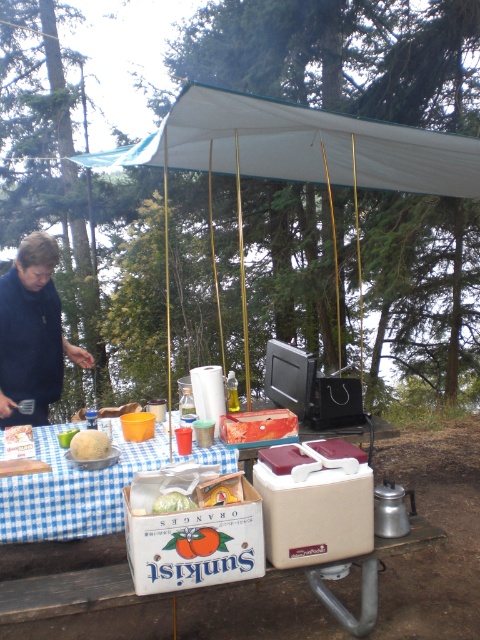
Can you confirm if blue checkered tablecloth at lower left is smaller than white fluffy bread at center?

No, blue checkered tablecloth at lower left is not smaller than white fluffy bread at center.

Between point (39, 538) and point (93, 432), which one is positioned behind?

The point (93, 432) is more distant.

The height and width of the screenshot is (640, 480). Identify the location of blue checkered tablecloth at lower left. (73, 488).

Is white fabric canopy at upper center shorter than translucent plastic bag at center?

In fact, white fabric canopy at upper center may be taller than translucent plastic bag at center.

Can you confirm if white fabric canopy at upper center is positioned to the right of translucent plastic bag at center?

Yes, white fabric canopy at upper center is to the right of translucent plastic bag at center.

Does point (313, 168) lie in front of point (167, 497)?

No, (313, 168) is further to viewer.

What are the coordinates of `white fabric canopy at upper center` in the screenshot? It's located at (299, 145).

Does white fabric canopy at upper center come in front of dark blue fabric at left?

That is True.

Between white fabric canopy at upper center and dark blue fabric at left, which one has more height?

With more height is dark blue fabric at left.

At what (x,y) coordinates should I click in order to perform the action: click on white fabric canopy at upper center. Please return your answer as a coordinate pair (x, y). Looking at the image, I should click on (299, 145).

This screenshot has height=640, width=480. In order to click on white fabric canopy at upper center in this screenshot , I will do `click(299, 145)`.